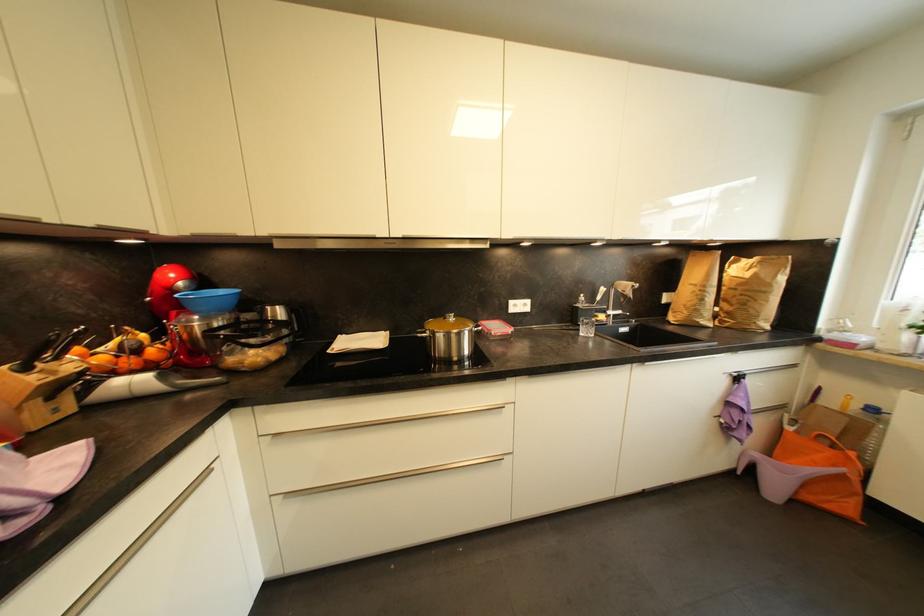
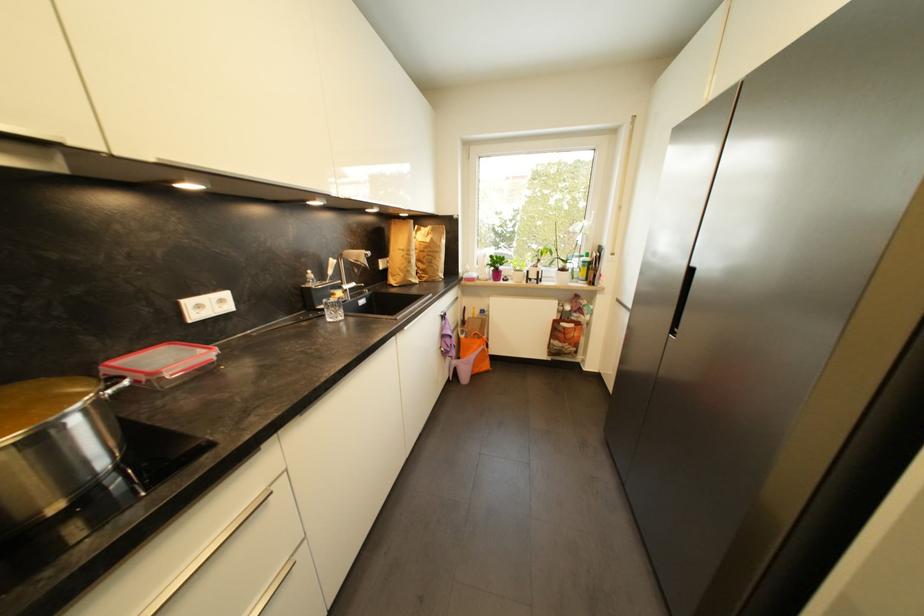
In the second image, find the point that corresponds to pixel 707 302 in the first image.

(415, 264)